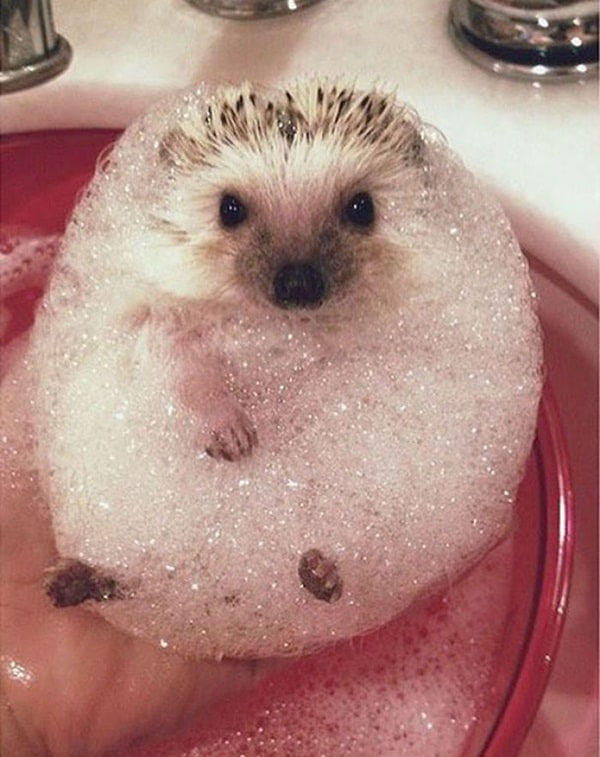
Where is `wash basin`? Image resolution: width=600 pixels, height=757 pixels. wash basin is located at coordinates (549, 609).